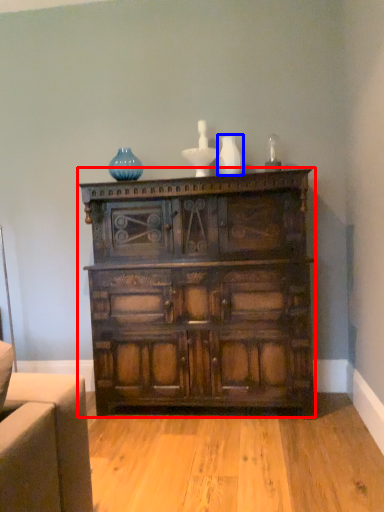
Question: Which point is closer to the camera, chest of drawers (highlighted by a red box) or vase (highlighted by a blue box)?

Choices:
 (A) chest of drawers
 (B) vase

Answer: (A)